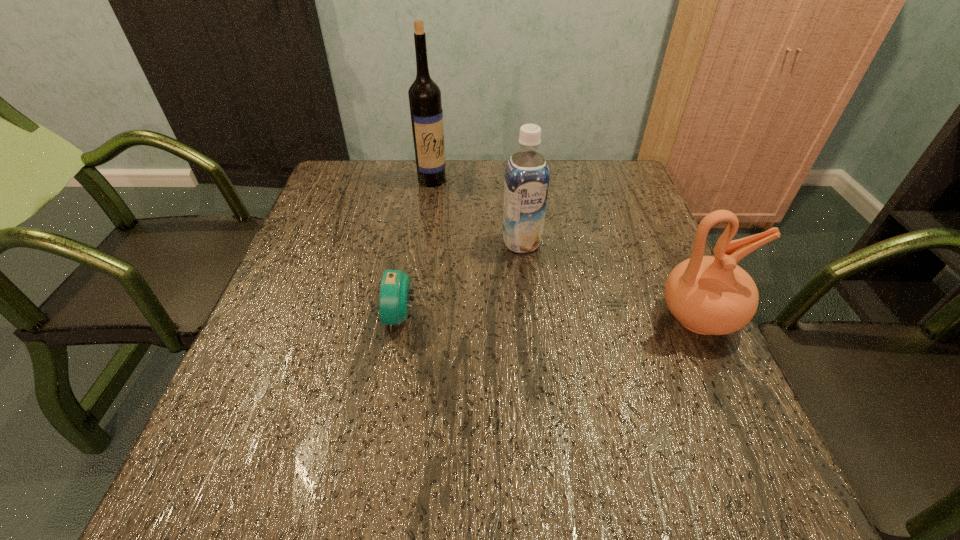
At what (x,y) coordinates should I click in order to perform the action: click on alarm clock. Please return your answer as a coordinate pair (x, y). Looking at the image, I should click on (394, 302).

Image resolution: width=960 pixels, height=540 pixels. What are the coordinates of `the rightmost object` in the screenshot? It's located at (708, 295).

This screenshot has height=540, width=960. Identify the location of the tallest object. (424, 94).

The image size is (960, 540). What are the coordinates of `the farthest object` in the screenshot? It's located at (424, 94).

Where is `soya milk`? This screenshot has width=960, height=540. soya milk is located at coordinates (526, 184).

Find the location of a particular element. the second farthest object is located at coordinates (526, 184).

Find the location of a particular element. free space located 0.070m on the front-facing side of the alarm clock is located at coordinates (351, 316).

This screenshot has width=960, height=540. Find the location of `vacant position located on the front-facing side of the alarm clock`. vacant position located on the front-facing side of the alarm clock is located at coordinates (276, 316).

At what (x,y) coordinates should I click in order to perform the action: click on vacant area located 0.210m on the front-facing side of the alarm clock. Please return your answer as a coordinate pair (x, y). This screenshot has height=540, width=960. Looking at the image, I should click on (285, 316).

Locate an element on the screen. This screenshot has height=540, width=960. free space located 0.250m on the label of the farthest object is located at coordinates (471, 237).